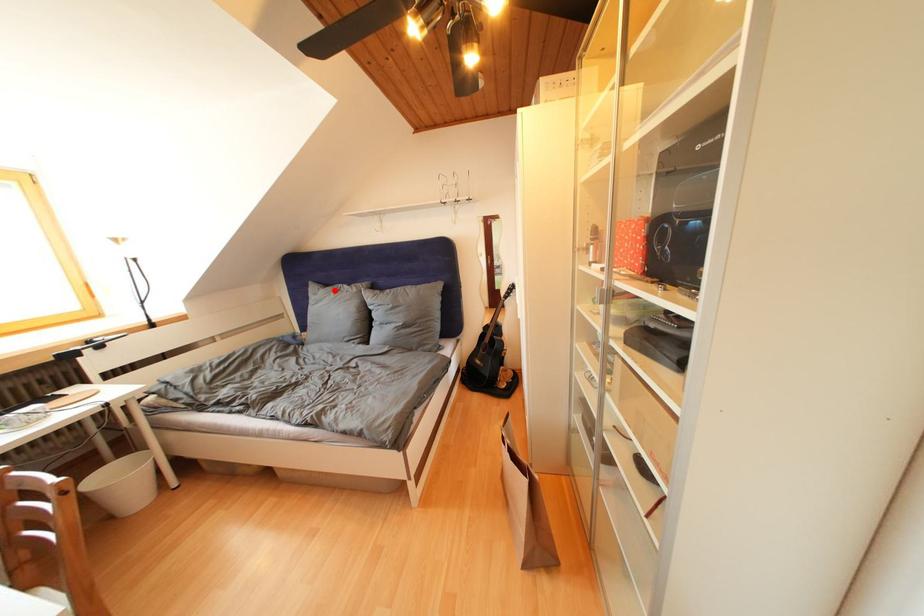
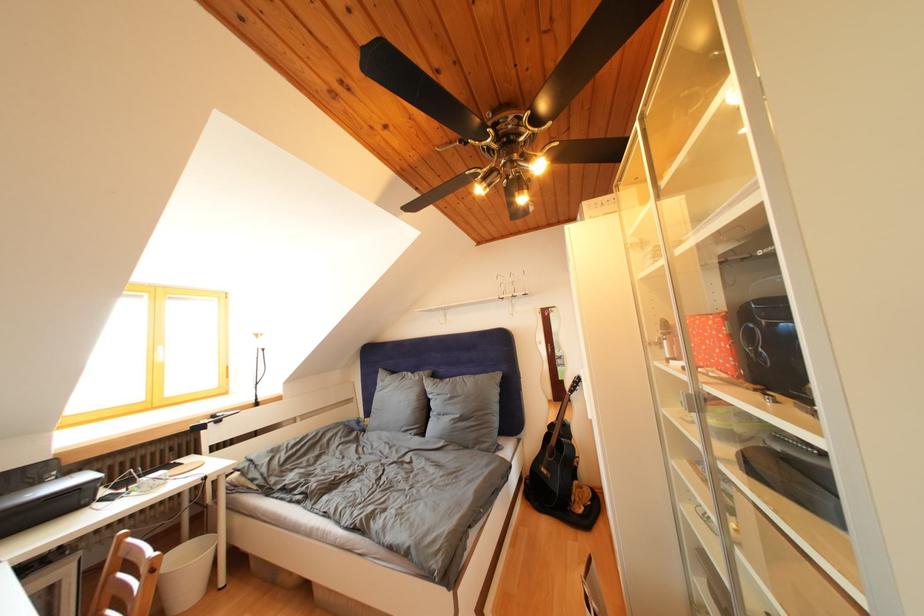
Find the pixel in the second image that matches the highlighted location in the first image.

(400, 378)